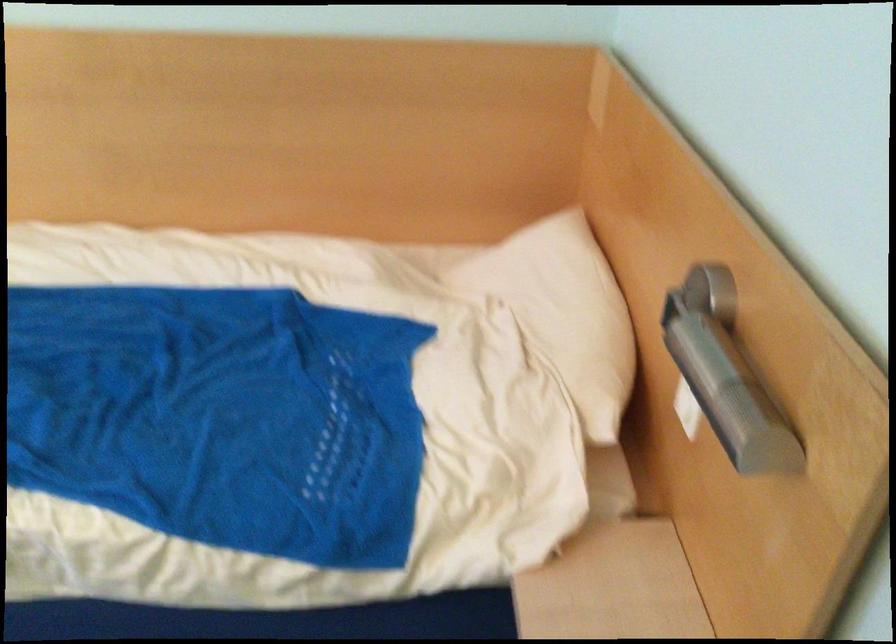
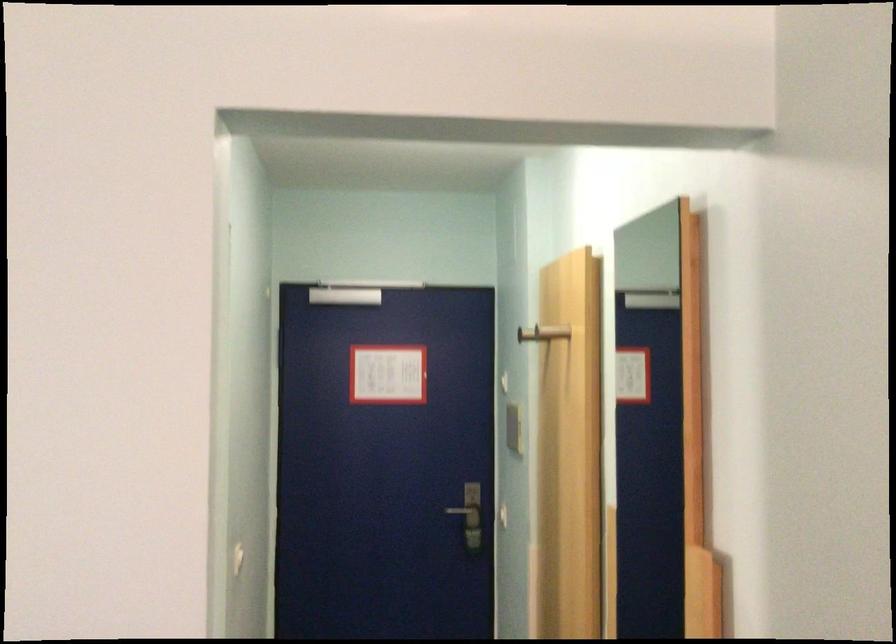
Question: Based on the continuous images, in which direction is the camera rotating? Reply with the corresponding letter.

Choices:
 (A) Left
 (B) Right
 (C) Up
 (D) Down

Answer: (B)